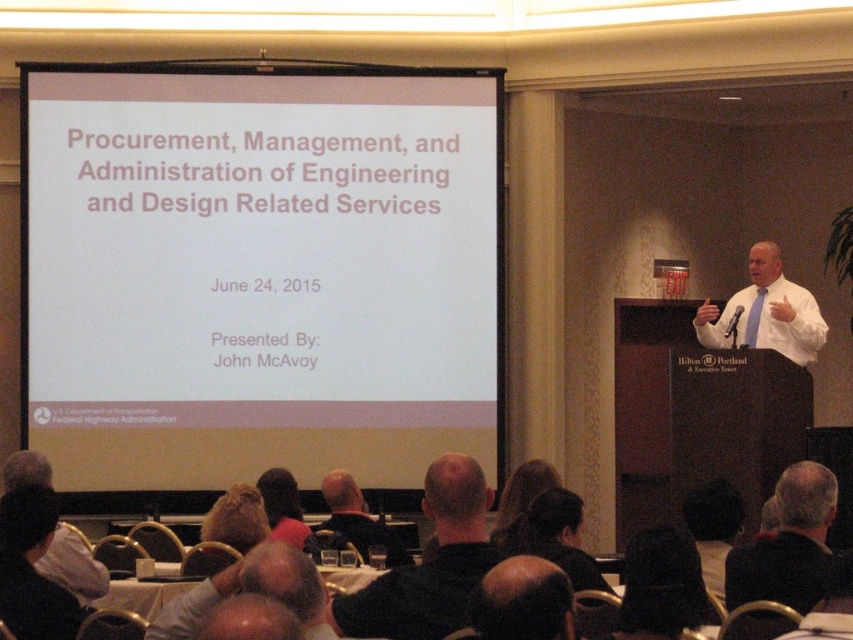
Between black hair at upper center and bald head at center, which one is positioned lower?

bald head at center

Does black hair at upper center appear on the right side of bald head at center?

Correct, you'll find black hair at upper center to the right of bald head at center.

Locate an element on the screen. black hair at upper center is located at coordinates (662, 586).

Based on the photo, which is above, white shirt at center or dark brown hair at center?

white shirt at center is higher up.

Is point (813, 330) more distant than point (543, 573)?

Yes, point (813, 330) is behind point (543, 573).

Where is `white shirt at center`? This screenshot has width=853, height=640. white shirt at center is located at coordinates (766, 312).

The height and width of the screenshot is (640, 853). I want to click on white shirt at center, so click(x=766, y=312).

Who is more distant from viewer, (x=558, y=566) or (x=521, y=524)?

The point (x=521, y=524) is more distant.

Does dark brown hair at center have a lesser height compared to black hair at lower center?

Indeed, dark brown hair at center has a lesser height compared to black hair at lower center.

Consider the image. Who is more distant from viewer, (491, 586) or (587, 563)?

The point (587, 563) is more distant.

At what (x,y) coordinates should I click in order to perform the action: click on dark brown hair at center. Please return your answer as a coordinate pair (x, y). Looking at the image, I should click on (521, 602).